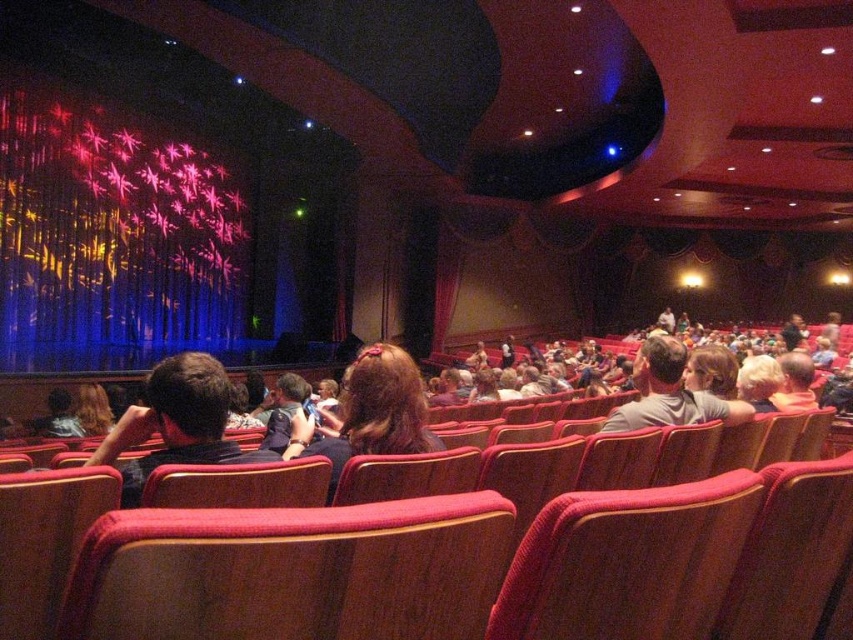
Who is positioned more to the right, velvet red seat at center or matte black hair at center?

From the viewer's perspective, velvet red seat at center appears more on the right side.

Is velvet red seat at center positioned behind matte black hair at center?

No, velvet red seat at center is closer to the viewer.

In order to click on velvet red seat at center in this screenshot , I will do `click(627, 563)`.

Locate an element on the screen. This screenshot has width=853, height=640. velvet red seat at center is located at coordinates (627, 563).

Does point (416, 518) come in front of point (209, 381)?

Yes.

Is point (378, 621) less distant than point (204, 376)?

Yes, point (378, 621) is in front of point (204, 376).

This screenshot has height=640, width=853. Identify the location of wooden seat at center. (292, 572).

Can you confirm if matte black hair at center is shorter than matte gray shirt at center?

Correct, matte black hair at center is not as tall as matte gray shirt at center.

Locate an element on the screen. The image size is (853, 640). matte black hair at center is located at coordinates (177, 422).

This screenshot has width=853, height=640. I want to click on matte black hair at center, so click(x=177, y=422).